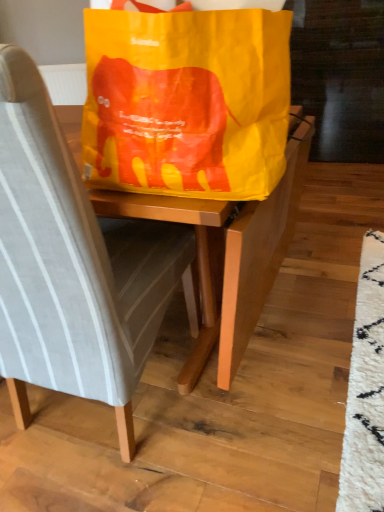
The image size is (384, 512). Find the location of `vacant location below light gray fabric chair at center (from a real-world perspective)`. vacant location below light gray fabric chair at center (from a real-world perspective) is located at coordinates (99, 405).